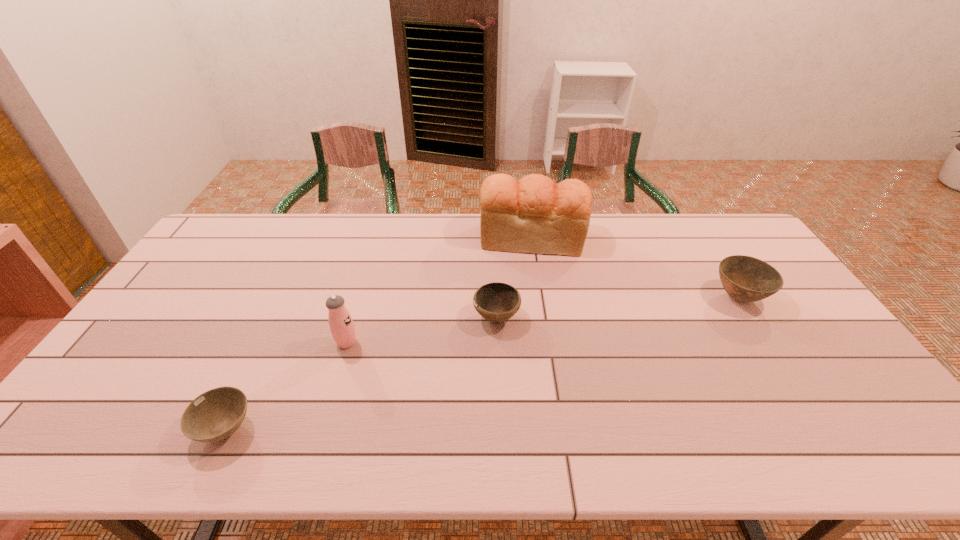
You are a GUI agent. You are given a task and a screenshot of the screen. Output one action in this format:
    pyautogui.click(x=<x>, y=<y>)
    Task: Click on the free space located 0.340m on the back of the fourth object from right to left
    This screenshot has width=960, height=540.
    Given the screenshot: What is the action you would take?
    pyautogui.click(x=372, y=260)

This screenshot has width=960, height=540. Identify the location of free space located on the front of the tallest bowl. (812, 414).

Locate an element on the screen. vacant point located 0.400m on the back of the second bowl from right to left is located at coordinates (x=493, y=227).

Find the location of a particular element. The width and height of the screenshot is (960, 540). free space located 0.160m on the back of the nearest object is located at coordinates coord(262,353).

Locate an element on the screen. The width and height of the screenshot is (960, 540). object present at the far edge is located at coordinates (534, 215).

Where is `object located at the near edge`? object located at the near edge is located at coordinates (216, 414).

Locate an element on the screen. The image size is (960, 540). object present at the right edge is located at coordinates (746, 279).

At what (x,y) coordinates should I click in order to perform the action: click on blank area at the far edge. Please return your answer as a coordinate pair (x, y). Looking at the image, I should click on (375, 219).

This screenshot has height=540, width=960. I want to click on free space at the near edge of the desktop, so click(521, 452).

The width and height of the screenshot is (960, 540). What are the coordinates of `vacant space at the left edge of the desktop` in the screenshot? It's located at (192, 302).